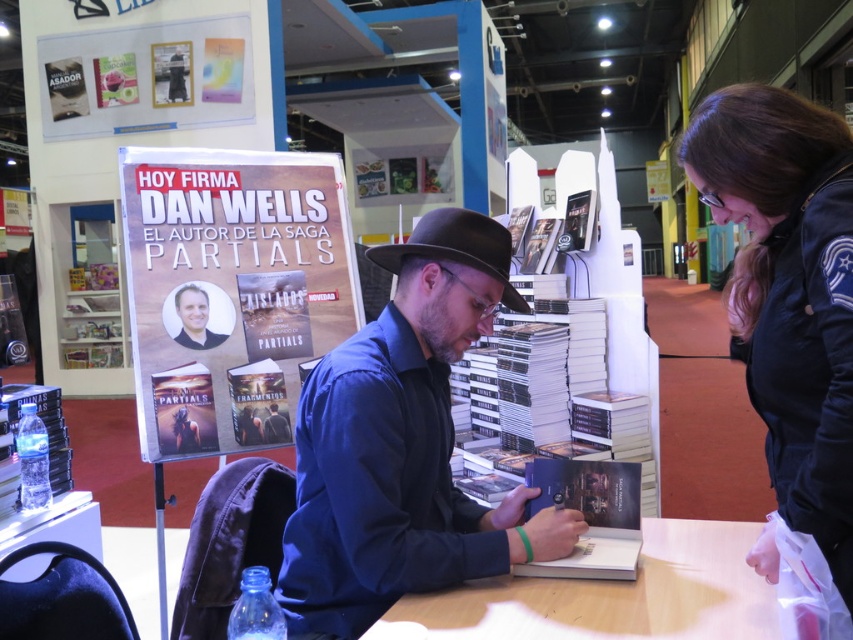
You are an attendee at the book signing event and want to place a new book on the table. Where should you position yourself relative to the blue cotton shirt at center to ensure the wooden table at center is accessible?

You should position yourself behind the blue cotton shirt at center because the wooden table at center is located behind it, allowing you to access the table easily.

Based on the coordinates provided, which object is located at point [403,444] in the image?

The point [403,444] corresponds to the blue cotton shirt at center.